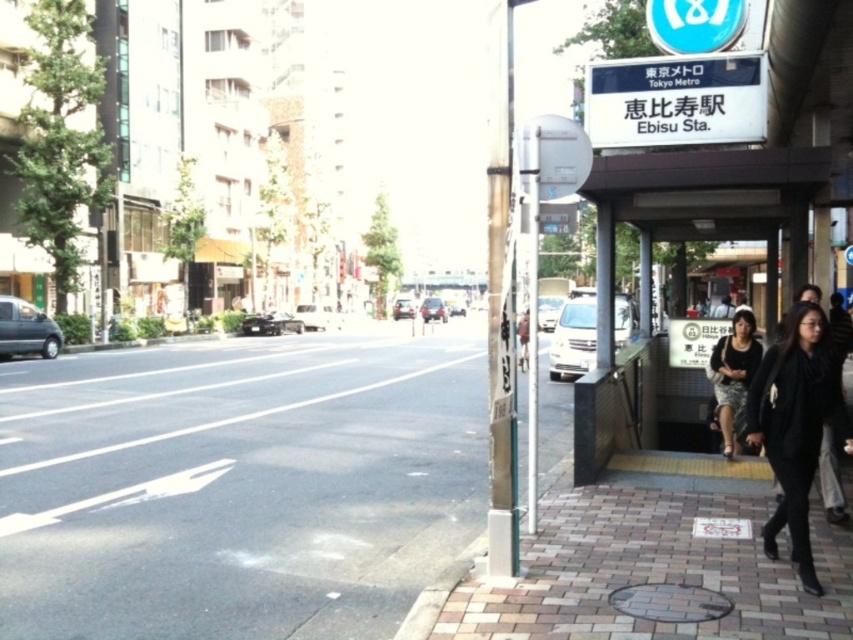
Question: Observing the image, what is the correct spatial positioning of black wool coat at lower right in reference to black textured skirt at lower right?

Choices:
 (A) right
 (B) left

Answer: (B)

Question: Can you confirm if black wool coat at lower right is wider than black textured skirt at lower right?

Choices:
 (A) no
 (B) yes

Answer: (B)

Question: Which point appears closest to the camera in this image?

Choices:
 (A) (218, 392)
 (B) (825, 369)

Answer: (B)

Question: Considering the real-world distances, which object is closest to the black wool coat at lower right?

Choices:
 (A) black textured skirt at lower right
 (B) gray concrete pavement at lower left

Answer: (A)

Question: Which is farther from the black wool coat at lower right?

Choices:
 (A) black textured skirt at lower right
 (B) gray concrete pavement at lower left

Answer: (B)

Question: Does gray concrete pavement at lower left have a lesser width compared to black textured skirt at lower right?

Choices:
 (A) no
 (B) yes

Answer: (A)